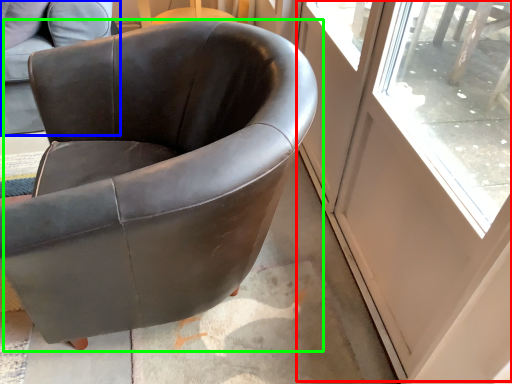
Question: Considering the real-world distances, which object is closest to screen door (highlighted by a red box)? chair (highlighted by a blue box) or chair (highlighted by a green box).

Choices:
 (A) chair
 (B) chair

Answer: (B)